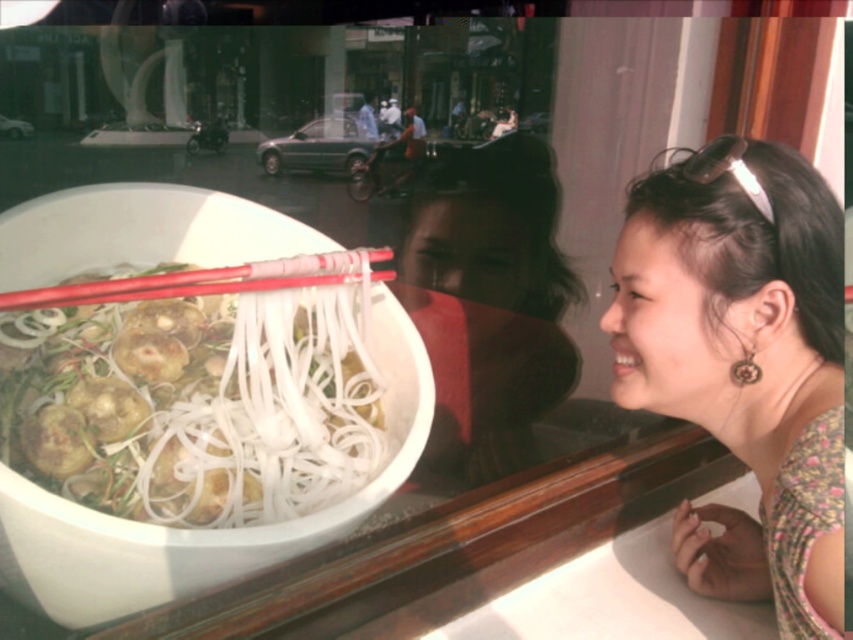
Describe the element at coordinates (744, 362) in the screenshot. The height and width of the screenshot is (640, 853). I see `floral fabric headband at upper right` at that location.

Who is lower down, floral fabric headband at upper right or red plastic chopsticks at center?

Positioned lower is floral fabric headband at upper right.

The height and width of the screenshot is (640, 853). In order to click on floral fabric headband at upper right in this screenshot , I will do `click(744, 362)`.

Image resolution: width=853 pixels, height=640 pixels. I want to click on floral fabric headband at upper right, so click(x=744, y=362).

Is point (155, 316) positioned before point (764, 292)?

No, it is behind (764, 292).

Which is below, white matte noodles at center or floral fabric headband at upper right?

floral fabric headband at upper right

Is point (109, 381) closer to camera compared to point (683, 566)?

No, it is not.

Locate an element on the screen. white matte noodles at center is located at coordinates (198, 388).

Does matte black hair at upper center have a lesser width compared to red plastic chopsticks at center?

Incorrect, matte black hair at upper center's width is not less than red plastic chopsticks at center's.

Who is higher up, matte black hair at upper center or red plastic chopsticks at center?

matte black hair at upper center

At what (x,y) coordinates should I click in order to perform the action: click on matte black hair at upper center. Please return your answer as a coordinate pair (x, y). This screenshot has width=853, height=640. Looking at the image, I should click on (488, 300).

I want to click on matte black hair at upper center, so click(488, 300).